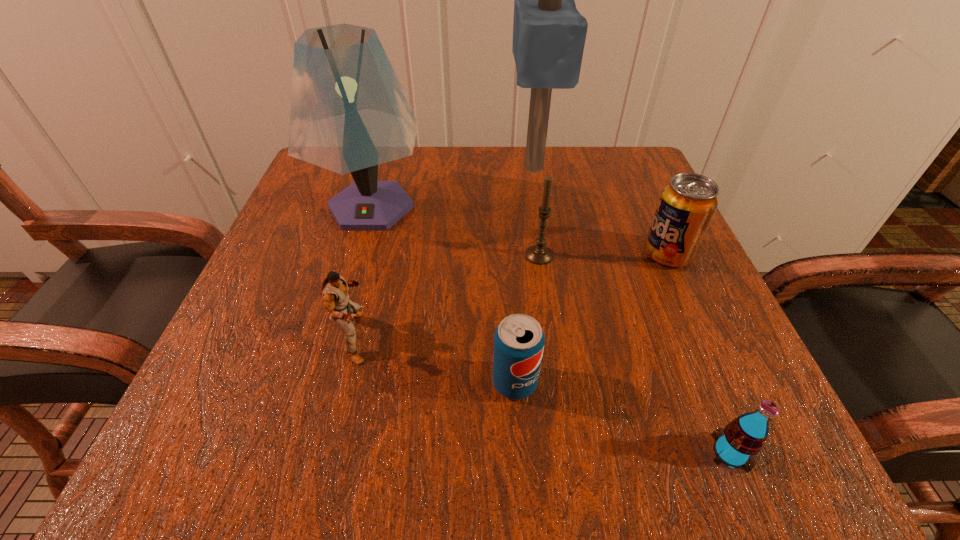
Locate an element on the screen. The height and width of the screenshot is (540, 960). blank space located on the back of the farthest soda is located at coordinates (623, 155).

You are a GUI agent. You are given a task and a screenshot of the screen. Output one action in this format:
    pyautogui.click(x=<x>, y=<y>)
    Task: Click on the free region located on the front-facing side of the puncher
    This screenshot has height=540, width=960.
    Given the screenshot: What is the action you would take?
    pyautogui.click(x=498, y=338)

The image size is (960, 540). In order to click on vacant position located on the right of the second farthest soda in this screenshot , I will do `click(595, 382)`.

The height and width of the screenshot is (540, 960). In order to click on vacant area located on the left of the nearest object in this screenshot , I will do `click(516, 453)`.

Identify the location of mallet at the far edge. The image size is (960, 540). (549, 33).

At what (x,y) coordinates should I click in order to perform the action: click on lampshade that is positioned at the far edge. Please return your answer as a coordinate pair (x, y). The image size is (960, 540). Looking at the image, I should click on (349, 113).

The height and width of the screenshot is (540, 960). Identify the location of object that is at the near edge. (744, 437).

Identify the location of object that is at the left edge. (349, 113).

What are the coordinates of `object present at the far left corner` in the screenshot? It's located at (349, 113).

You are a GUI agent. You are given a task and a screenshot of the screen. Output one action in this format:
    pyautogui.click(x=<x>, y=<y>)
    Task: Click on the object that is at the near right corner
    
    Given the screenshot: What is the action you would take?
    pyautogui.click(x=744, y=437)